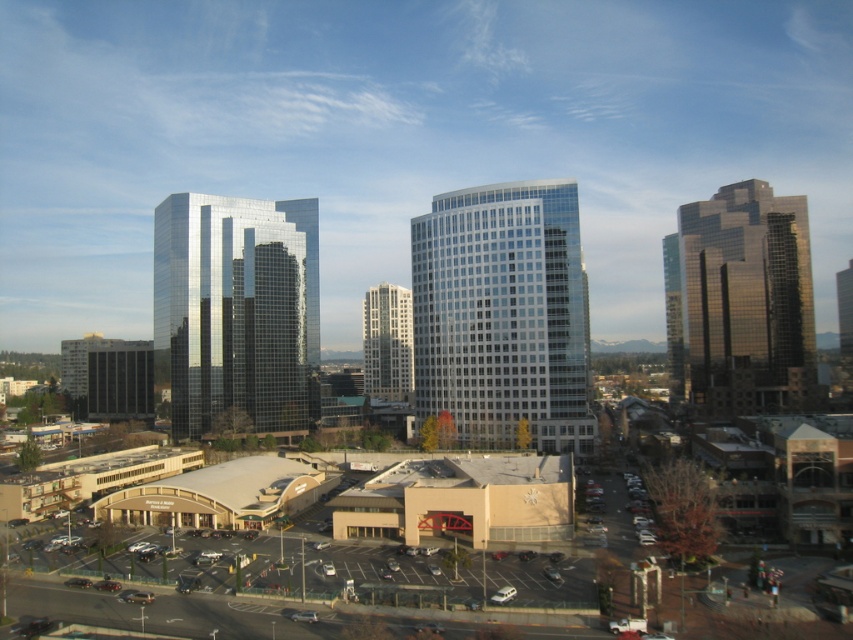
Between clear glass building at center and glossy glass building at center-left, which one appears on the right side from the viewer's perspective?

Positioned to the right is clear glass building at center.

Can you confirm if clear glass building at center is bigger than glossy glass building at center-left?

Correct, clear glass building at center is larger in size than glossy glass building at center-left.

Where is `clear glass building at center`? This screenshot has width=853, height=640. clear glass building at center is located at coordinates coord(502,314).

Can you confirm if clear glass building at center is positioned below glassy reflective building at center?

No, clear glass building at center is not below glassy reflective building at center.

Which is behind, point (447, 266) or point (379, 316)?

Point (379, 316)

The image size is (853, 640). Find the location of `clear glass building at center`. clear glass building at center is located at coordinates (502, 314).

Who is higher up, gold reflective glass building at right or glassy reflective building at center?

Positioned higher is gold reflective glass building at right.

Is gold reflective glass building at right in front of glassy reflective building at center?

That is True.

The height and width of the screenshot is (640, 853). What do you see at coordinates (740, 301) in the screenshot? I see `gold reflective glass building at right` at bounding box center [740, 301].

I want to click on gold reflective glass building at right, so click(x=740, y=301).